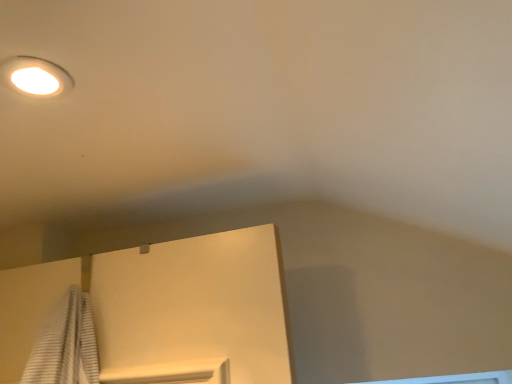
This screenshot has width=512, height=384. I want to click on white glossy droplight at upper left, so (35, 76).

Describe the element at coordinates (35, 76) in the screenshot. I see `white glossy droplight at upper left` at that location.

Locate an element on the screen. This screenshot has height=384, width=512. white glossy droplight at upper left is located at coordinates (35, 76).